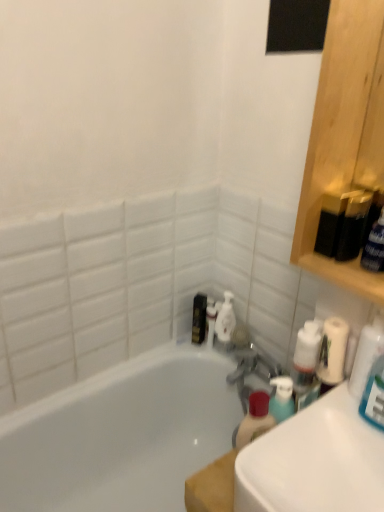
The image size is (384, 512). Describe the element at coordinates (225, 319) in the screenshot. I see `white glossy bottle at center` at that location.

What do you see at coordinates (210, 321) in the screenshot? This screenshot has width=384, height=512. I see `white plastic soap dispenser at lower center, the first toiletry positioned from the right` at bounding box center [210, 321].

Measure the distance between point (41, 422) and camera.

4.49 feet.

What do you see at coordinates (121, 435) in the screenshot? This screenshot has height=512, width=384. I see `white glossy bathtub at center` at bounding box center [121, 435].

Where is `white glossy bottle at center`? The height and width of the screenshot is (512, 384). white glossy bottle at center is located at coordinates (225, 319).

Considering the positions of objects white glossy sink at lower right and white glossy bathtub at center in the image provided, who is behind, white glossy sink at lower right or white glossy bathtub at center?

white glossy bathtub at center is further away from the camera.

Which object is positioned more to the left, white glossy sink at lower right or white glossy bathtub at center?

white glossy bathtub at center.

From a real-world perspective, which object rests below the other?

white glossy bathtub at center is physically lower.

Can you confirm if white glossy sink at lower right is bigger than white glossy bathtub at center?

No.

Looking at this image, considering the sizes of white glossy sink at lower right and white glossy bottle at center in the image, is white glossy sink at lower right taller or shorter than white glossy bottle at center?

Considering their sizes, white glossy sink at lower right has less height than white glossy bottle at center.

Is white glossy sink at lower right positioned with its back to white glossy bottle at center?

white glossy sink at lower right is not turned away from white glossy bottle at center.

Is white glossy sink at lower right bigger or smaller than white glossy bottle at center?

In the image, white glossy sink at lower right appears to be larger than white glossy bottle at center.

Does white glossy sink at lower right come behind white glossy bottle at center?

No, white glossy sink at lower right is closer to the viewer.

Is white plastic soap dispenser at lower center, the first toiletry positioned from the right, oriented away from white glossy sink at lower right?

white plastic soap dispenser at lower center, the first toiletry positioned from the right, is not turned away from white glossy sink at lower right.

From a real-world perspective, is white plastic soap dispenser at lower center, the first toiletry positioned from the right, below white glossy sink at lower right?

Yes.

Considering the sizes of objects white plastic soap dispenser at lower center, arranged as the second toiletry when viewed from the left, and white glossy sink at lower right in the image provided, who is wider, white plastic soap dispenser at lower center, arranged as the second toiletry when viewed from the left, or white glossy sink at lower right?

Wider between the two is white glossy sink at lower right.

From the image's perspective, relative to white glossy sink at lower right, is white plastic soap dispenser at lower center, the first toiletry positioned from the right, above or below?

Based on their image positions, white plastic soap dispenser at lower center, the first toiletry positioned from the right, is located above white glossy sink at lower right.

From the image's perspective, is white plastic soap dispenser at lower center, the first toiletry positioned from the right, positioned above or below metallic gold toiletry at center, which is counted as the first toiletry, starting from the left?

Based on their image positions, white plastic soap dispenser at lower center, the first toiletry positioned from the right, is located above metallic gold toiletry at center, which is counted as the first toiletry, starting from the left.

Where is `toiletry above the metallic gold toiletry at center, which is counted as the first toiletry, starting from the left (from the image's perspective)`? This screenshot has height=512, width=384. toiletry above the metallic gold toiletry at center, which is counted as the first toiletry, starting from the left (from the image's perspective) is located at coordinates (210, 321).

Is metallic gold toiletry at center, which is counted as the first toiletry, starting from the left, wider or thinner than white glossy sink at lower right?

Considering their sizes, metallic gold toiletry at center, which is counted as the first toiletry, starting from the left, looks slimmer than white glossy sink at lower right.

Which object is closer to the camera taking this photo, metallic gold toiletry at center, which is counted as the first toiletry, starting from the left, or white glossy sink at lower right?

white glossy sink at lower right is more forward.

From the image's perspective, starting from the white glossy bottle at center, which toiletry is the 1st one above? Please provide its 2D coordinates.

[(199, 318)]

Is metallic gold toiletry at center, which is counted as the first toiletry, starting from the left, next to white glossy bottle at center?

Yes, the surface of metallic gold toiletry at center, which is counted as the first toiletry, starting from the left, is in contact with white glossy bottle at center.

Is white glossy bottle at center located within metallic gold toiletry at center, acting as the second toiletry starting from the right?

No, white glossy bottle at center is not inside metallic gold toiletry at center, acting as the second toiletry starting from the right.

Which is in front, metallic gold toiletry at center, which is counted as the first toiletry, starting from the left, or white glossy bottle at center?

Positioned in front is white glossy bottle at center.

Is white glossy bottle at center turned away from metallic gold toiletry at center, which is counted as the first toiletry, starting from the left?

white glossy bottle at center is not turned away from metallic gold toiletry at center, which is counted as the first toiletry, starting from the left.

Which object is positioned more to the left, white glossy bottle at center or metallic gold toiletry at center, which is counted as the first toiletry, starting from the left?

metallic gold toiletry at center, which is counted as the first toiletry, starting from the left.

Considering the sizes of objects white glossy bottle at center and metallic gold toiletry at center, which is counted as the first toiletry, starting from the left, in the image provided, who is bigger, white glossy bottle at center or metallic gold toiletry at center, which is counted as the first toiletry, starting from the left,?

Bigger between the two is metallic gold toiletry at center, which is counted as the first toiletry, starting from the left.

Find the location of a particular element. bathtub lying on the left of white glossy sink at lower right is located at coordinates (121, 435).

This screenshot has width=384, height=512. Find the location of `cleaning product above the white glossy sink at lower right (from the image's perspective)`. cleaning product above the white glossy sink at lower right (from the image's perspective) is located at coordinates (225, 319).

Estimate the real-world distances between objects in this image. Which object is further from white glossy sink at lower right, white glossy bottle at center or metallic gold toiletry at center, acting as the second toiletry starting from the right?

Based on the image, metallic gold toiletry at center, acting as the second toiletry starting from the right, appears to be further to white glossy sink at lower right.

Looking at the image, which one is located closer to white glossy bathtub at center, white glossy sink at lower right or white plastic soap dispenser at lower center, the first toiletry positioned from the right?

Based on the image, white plastic soap dispenser at lower center, the first toiletry positioned from the right, appears to be nearer to white glossy bathtub at center.

Considering their positions, is metallic gold toiletry at center, which is counted as the first toiletry, starting from the left, positioned further to white plastic soap dispenser at lower center, the first toiletry positioned from the right, than white glossy bathtub at center?

white glossy bathtub at center is positioned further to the anchor white plastic soap dispenser at lower center, the first toiletry positioned from the right.

Which object lies further to the anchor point white glossy bathtub at center, white glossy sink at lower right or white glossy bottle at center?

white glossy sink at lower right is further to white glossy bathtub at center.

From the image, which object appears to be farther from white glossy bottle at center, metallic gold toiletry at center, which is counted as the first toiletry, starting from the left, or white plastic soap dispenser at lower center, the first toiletry positioned from the right?

metallic gold toiletry at center, which is counted as the first toiletry, starting from the left, is further to white glossy bottle at center.

Estimate the real-world distances between objects in this image. Which object is further from white glossy bathtub at center, white glossy bottle at center or metallic gold toiletry at center, acting as the second toiletry starting from the right?

The object further to white glossy bathtub at center is white glossy bottle at center.

Based on their spatial positions, is metallic gold toiletry at center, acting as the second toiletry starting from the right, or white glossy bottle at center further from white glossy bathtub at center?

white glossy bottle at center lies further to white glossy bathtub at center than the other object.

Estimate the real-world distances between objects in this image. Which object is closer to metallic gold toiletry at center, which is counted as the first toiletry, starting from the left, white glossy bathtub at center or white glossy sink at lower right?

white glossy bathtub at center.

What are the coordinates of `toiletry between white glossy sink at lower right and metallic gold toiletry at center, acting as the second toiletry starting from the right, along the z-axis` in the screenshot? It's located at (210, 321).

What are the coordinates of `bathtub between white glossy sink at lower right and white glossy bottle at center along the z-axis` in the screenshot? It's located at (121, 435).

Locate an element on the screen. cleaning product between white glossy sink at lower right and white plastic soap dispenser at lower center, arranged as the second toiletry when viewed from the left, along the z-axis is located at coordinates (225, 319).

At what (x,y) coordinates should I click in order to perform the action: click on toiletry between white glossy bathtub at center and metallic gold toiletry at center, acting as the second toiletry starting from the right, along the z-axis. Please return your answer as a coordinate pair (x, y). Looking at the image, I should click on (210, 321).